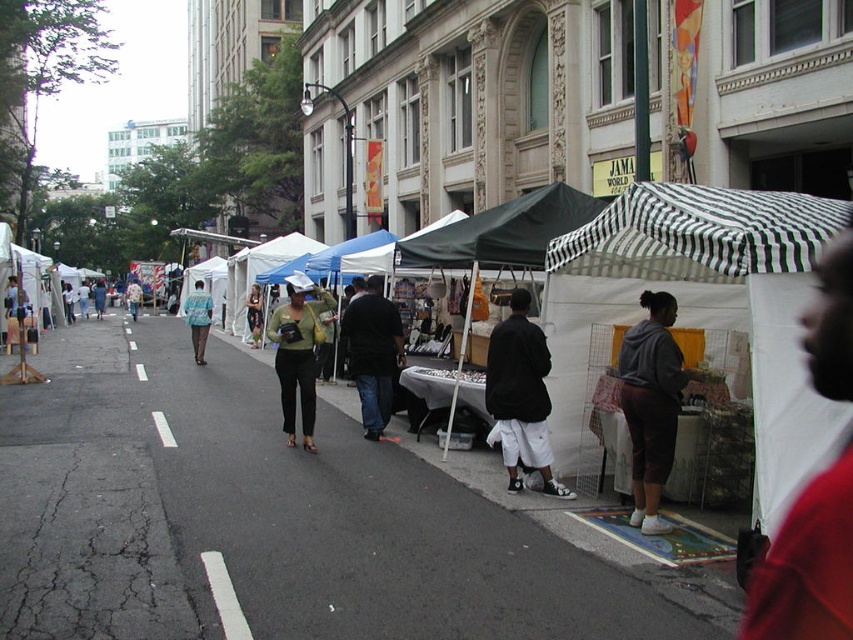
You are a customer at the market and want to find the black cotton pants at lower center. Which direction should you walk from the black and white striped canopy at right to locate them?

The black and white striped canopy at right is in front of the black cotton pants at lower center, so you should walk backward or turn around away from the canopy to find the pants.

You are standing at the entrance of the outdoor market and see a point marked at coordinates (807, 564). What object or person is located at that point?

The point at coordinates (807, 564) marks the red shirt at center.